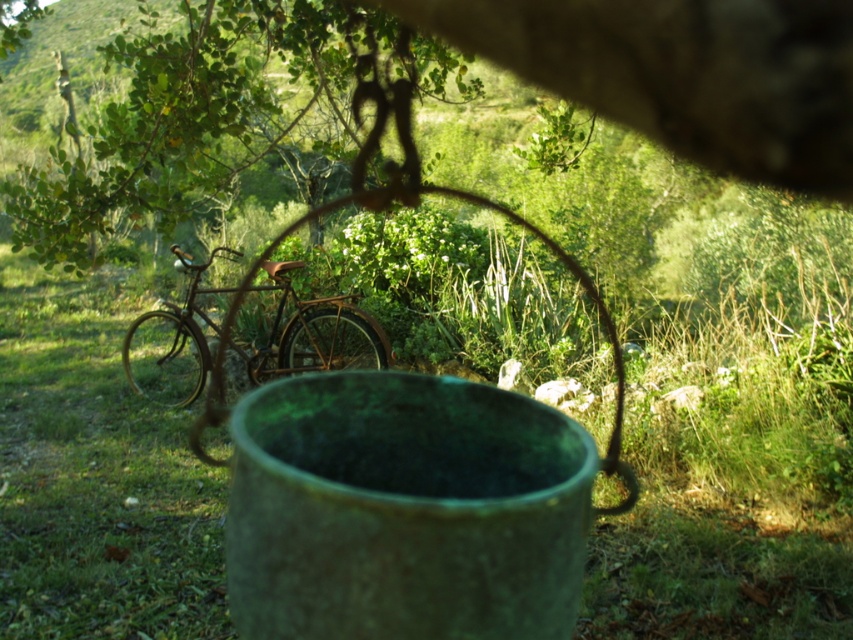
Question: Among these points, which one is nearest to the camera?

Choices:
 (A) (228, 250)
 (B) (842, 195)

Answer: (B)

Question: Is green leafy tree at upper center thinner than rusty metal bicycle at center?

Choices:
 (A) yes
 (B) no

Answer: (A)

Question: Which point appears farthest from the camera in this image?

Choices:
 (A) (299, 324)
 (B) (149, 188)

Answer: (A)

Question: Which of the following is the closest to the observer?

Choices:
 (A) (363, 330)
 (B) (815, 140)

Answer: (B)

Question: Can you confirm if green leafy tree at upper center is smaller than rusty metal bicycle at center?

Choices:
 (A) yes
 (B) no

Answer: (A)

Question: Considering the relative positions of green leafy tree at upper center and rusty metal bicycle at center in the image provided, where is green leafy tree at upper center located with respect to rusty metal bicycle at center?

Choices:
 (A) left
 (B) right

Answer: (B)